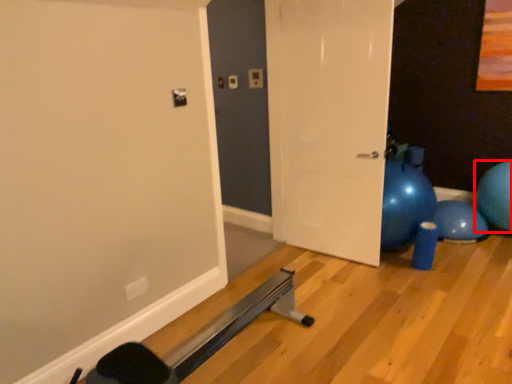
Question: From the image's perspective, where is ball (annotated by the red box) located in relation to door in the image?

Choices:
 (A) below
 (B) above

Answer: (A)